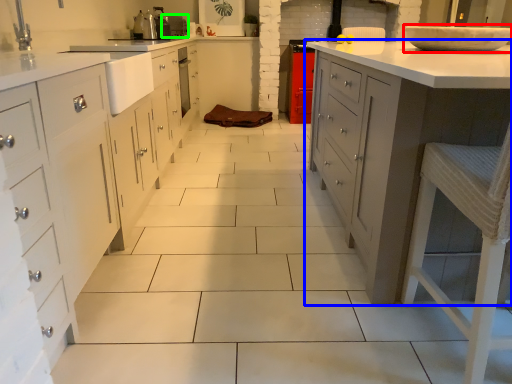
Question: Considering the real-world distances, which object is farthest from home appliance (highlighted by a red box)? countertop (highlighted by a blue box) or appliance (highlighted by a green box)?

Choices:
 (A) countertop
 (B) appliance

Answer: (B)